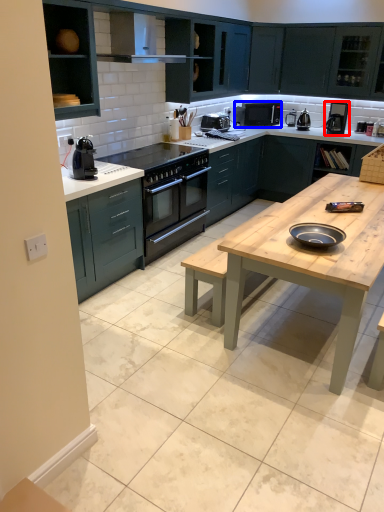
Question: Which point is closer to the camera, coffee machine (highlighted by a red box) or microwave oven (highlighted by a blue box)?

Choices:
 (A) coffee machine
 (B) microwave oven

Answer: (A)